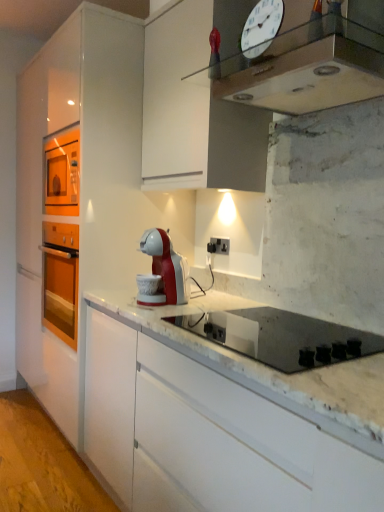
Question: Can black plastic electric outlet at center be found inside black glass gas stove at center?

Choices:
 (A) no
 (B) yes

Answer: (A)

Question: Considering the relative sizes of black glass gas stove at center and black plastic electric outlet at center in the image provided, is black glass gas stove at center shorter than black plastic electric outlet at center?

Choices:
 (A) no
 (B) yes

Answer: (A)

Question: Does black glass gas stove at center appear on the left side of black plastic electric outlet at center?

Choices:
 (A) no
 (B) yes

Answer: (A)

Question: Considering the relative sizes of black glass gas stove at center and black plastic electric outlet at center in the image provided, is black glass gas stove at center wider than black plastic electric outlet at center?

Choices:
 (A) yes
 (B) no

Answer: (A)

Question: From the image's perspective, is black glass gas stove at center above black plastic electric outlet at center?

Choices:
 (A) yes
 (B) no

Answer: (B)

Question: Is metallic silver clock at upper center wider or thinner than black glass gas stove at center?

Choices:
 (A) thin
 (B) wide

Answer: (A)

Question: From a real-world perspective, relative to black glass gas stove at center, is metallic silver clock at upper center vertically above or below?

Choices:
 (A) above
 (B) below

Answer: (A)

Question: Does point (311, 31) appear closer or farther from the camera than point (302, 315)?

Choices:
 (A) closer
 (B) farther

Answer: (A)

Question: From the image's perspective, relative to black glass gas stove at center, is metallic silver clock at upper center above or below?

Choices:
 (A) above
 (B) below

Answer: (A)

Question: Do you think white marble countertop at lower left is within white glossy cabinet at center, or outside of it?

Choices:
 (A) inside
 (B) outside

Answer: (B)

Question: Is white marble countertop at lower left in front of or behind white glossy cabinet at center in the image?

Choices:
 (A) behind
 (B) front

Answer: (B)

Question: Considering the positions of white marble countertop at lower left and white glossy cabinet at center in the image, is white marble countertop at lower left taller or shorter than white glossy cabinet at center?

Choices:
 (A) tall
 (B) short

Answer: (B)

Question: Is white marble countertop at lower left wider or thinner than white glossy cabinet at center?

Choices:
 (A) wide
 (B) thin

Answer: (A)

Question: In terms of width, does white glass clock at upper center look wider or thinner when compared to metallic silver clock at upper center?

Choices:
 (A) thin
 (B) wide

Answer: (A)

Question: From their relative heights in the image, would you say white glass clock at upper center is taller or shorter than metallic silver clock at upper center?

Choices:
 (A) tall
 (B) short

Answer: (A)